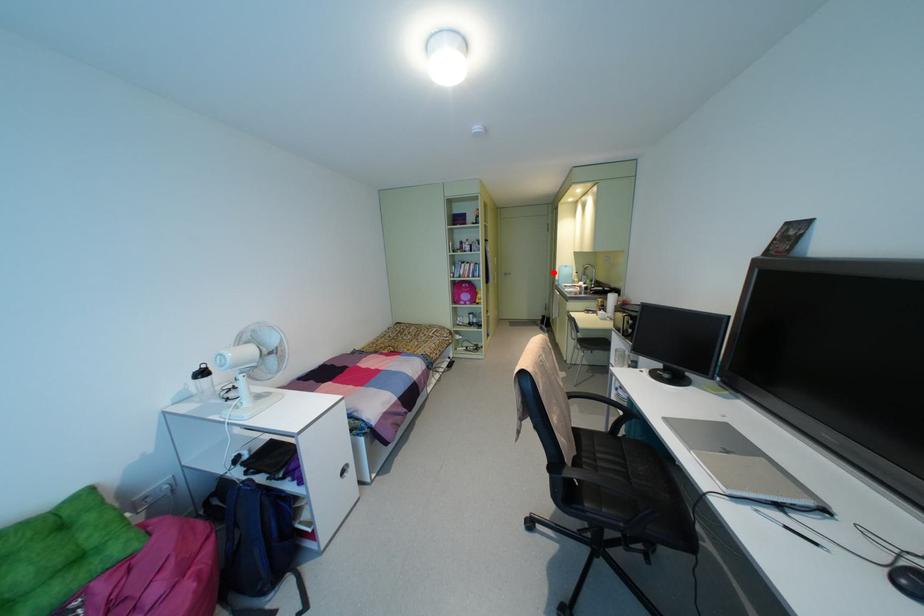
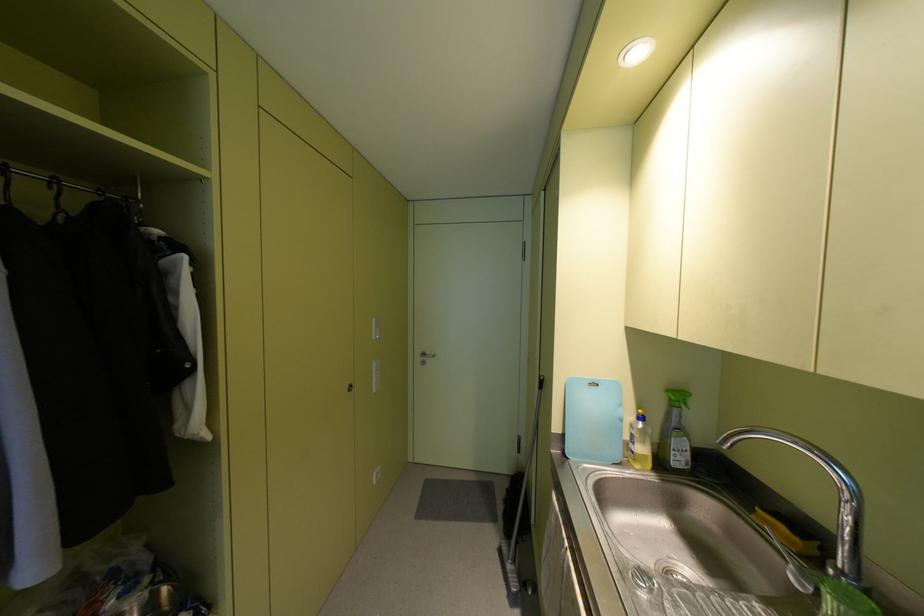
Question: I am providing you with two images of the same scene from different viewpoints. In image1, a red point is highlighted. Considering the same 3D point in image2, which of the following is correct?

Choices:
 (A) It is closer
 (B) It is farther

Answer: (B)